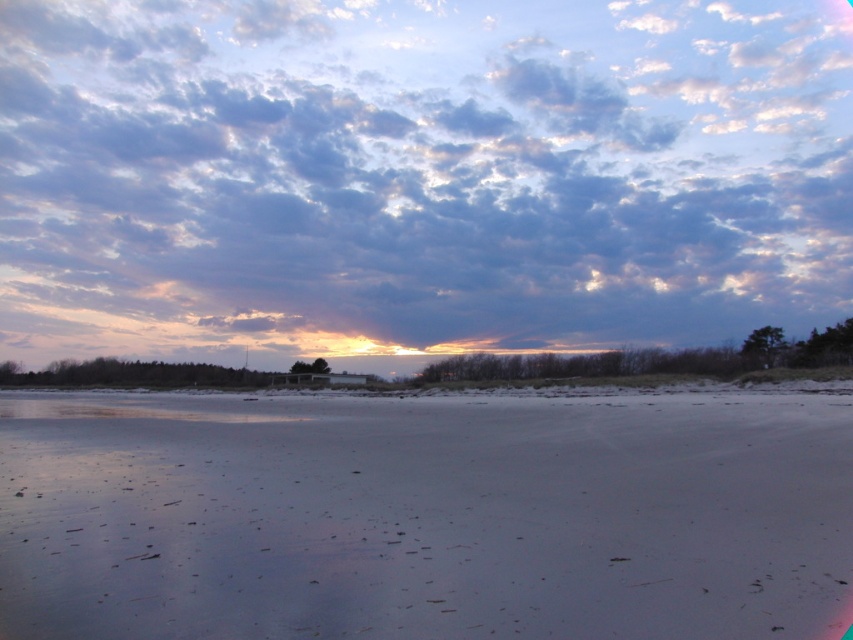
Can you confirm if cloudy sky at upper center is taller than white sandy beach at center?

Correct, cloudy sky at upper center is much taller as white sandy beach at center.

Can you confirm if cloudy sky at upper center is positioned to the right of white sandy beach at center?

In fact, cloudy sky at upper center is to the left of white sandy beach at center.

Locate an element on the screen. cloudy sky at upper center is located at coordinates click(419, 173).

Where is `cloudy sky at upper center`? cloudy sky at upper center is located at coordinates (419, 173).